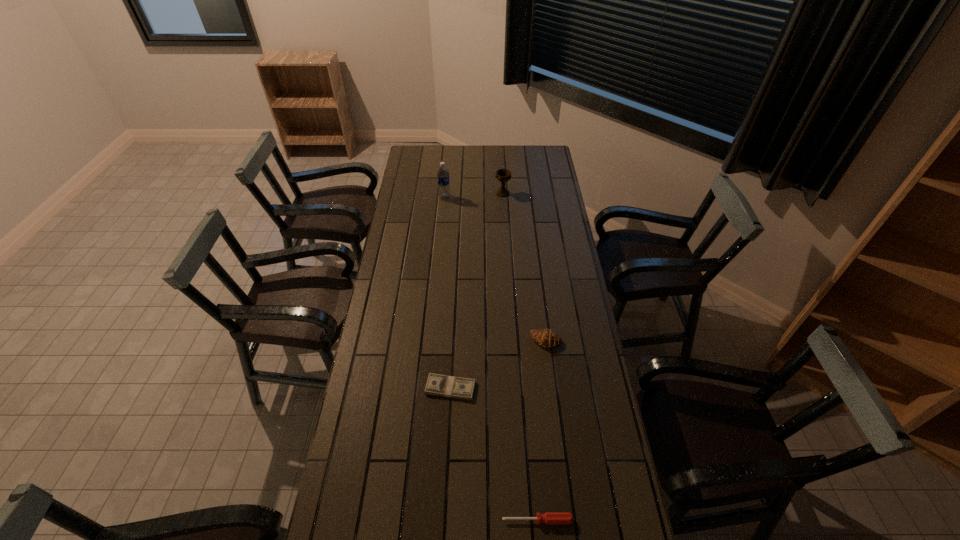
Image resolution: width=960 pixels, height=540 pixels. What are the coordinates of `vacant space in between the second tallest object and the screwdriver` in the screenshot? It's located at (520, 356).

Locate an element on the screen. free space that is in between the fourth tallest object and the fourth shortest object is located at coordinates (520, 356).

At what (x,y) coordinates should I click in order to perform the action: click on free space between the third nearest object and the screwdriver. Please return your answer as a coordinate pair (x, y). Looking at the image, I should click on (541, 430).

Identify the location of blank region between the second tallest object and the third nearest object. The height and width of the screenshot is (540, 960). (524, 267).

The image size is (960, 540). I want to click on free space between the shortest object and the fourth shortest object, so click(476, 291).

In order to click on empty space that is in between the third tallest object and the tallest object in this screenshot , I will do `click(495, 269)`.

You are a GUI agent. You are given a task and a screenshot of the screen. Output one action in this format:
    pyautogui.click(x=<x>, y=<y>)
    Task: Click on the free space that is in between the third farthest object and the nearest object
    This screenshot has height=540, width=960.
    Given the screenshot: What is the action you would take?
    pyautogui.click(x=541, y=430)

Locate an element on the screen. empty location between the shortest object and the third tallest object is located at coordinates (498, 364).

Where is `the third closest object to the shortest object`? the third closest object to the shortest object is located at coordinates (442, 174).

Where is `object that is the fourth closest to the third tallest object`? object that is the fourth closest to the third tallest object is located at coordinates (442, 174).